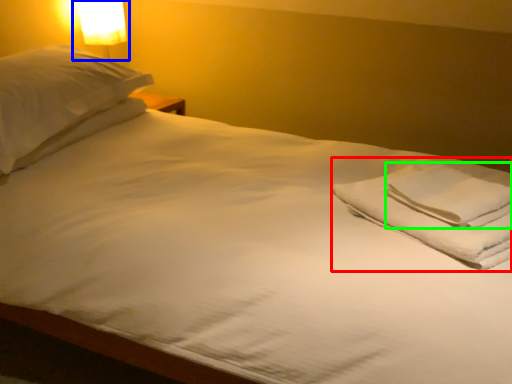
Question: Which object is positioned farthest from material (highlighted by a red box)? Select from bedside lamp (highlighted by a blue box) and hand towel (highlighted by a green box).

Choices:
 (A) bedside lamp
 (B) hand towel

Answer: (A)